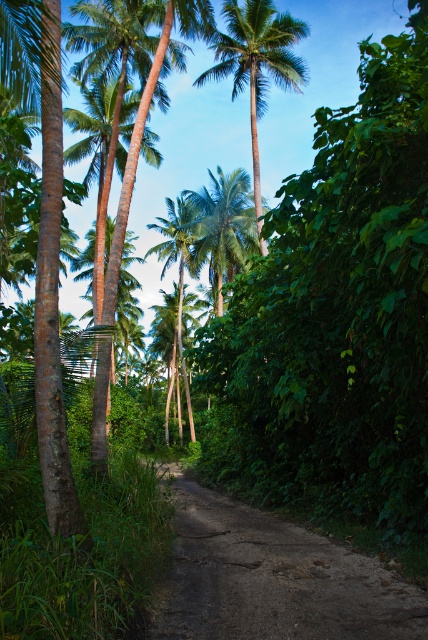
Who is more distant from viewer, (234, 525) or (220, 52)?

Point (220, 52)

Does dirt road at center have a smaller size compared to green leafy palm tree at upper center?

Yes, dirt road at center is smaller than green leafy palm tree at upper center.

At what (x,y) coordinates should I click in order to perform the action: click on dirt road at center. Please return your answer as a coordinate pair (x, y). Looking at the image, I should click on (273, 579).

Is green leafy palm tree at upper center shorter than green leafy palm tree at center?

No, green leafy palm tree at upper center is not shorter than green leafy palm tree at center.

Is green leafy palm tree at upper center to the left of green leafy palm tree at center from the viewer's perspective?

In fact, green leafy palm tree at upper center is to the right of green leafy palm tree at center.

Locate an element on the screen. green leafy palm tree at upper center is located at coordinates (256, 65).

Which is in front, point (246, 525) or point (192, 216)?

Point (246, 525) is more forward.

Does dirt road at center have a larger size compared to green leafy palm tree at center?

Incorrect, dirt road at center is not larger than green leafy palm tree at center.

Locate an element on the screen. dirt road at center is located at coordinates (273, 579).